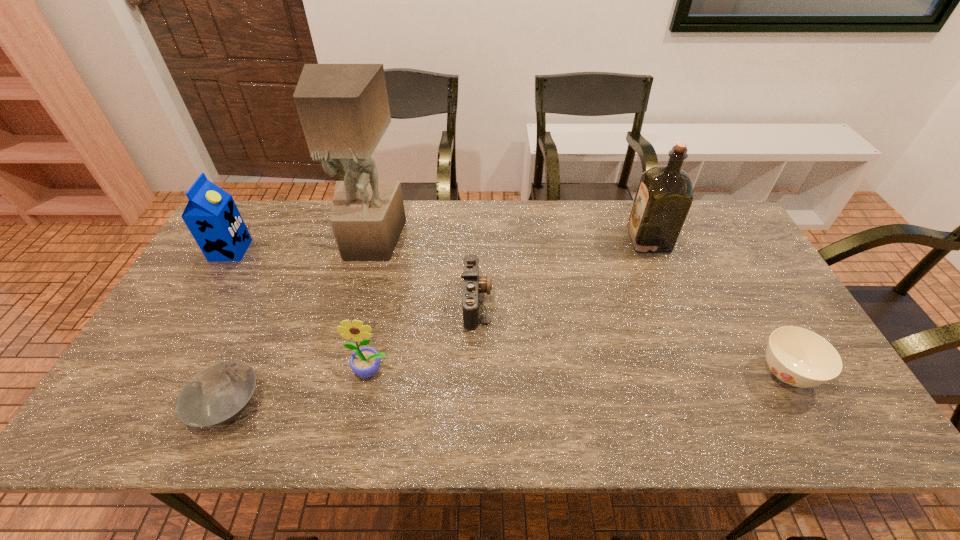
This screenshot has height=540, width=960. I want to click on sculpture that is at the far edge, so click(344, 111).

You are a GUI agent. You are given a task and a screenshot of the screen. Output one action in this format:
    pyautogui.click(x=<x>, y=<y>)
    Task: Click on the liquor at the far edge
    This screenshot has width=960, height=540.
    Given the screenshot: What is the action you would take?
    pyautogui.click(x=664, y=196)

I want to click on carton that is positioned at the far edge, so click(x=211, y=215).

Where is `object situated at the near edge`? object situated at the near edge is located at coordinates (219, 393).

You are a GUI agent. You are given a task and a screenshot of the screen. Output one action in this format:
    pyautogui.click(x=<x>, y=<y>)
    Task: Click on the object positioned at the left edge
    This screenshot has height=540, width=960.
    Given the screenshot: What is the action you would take?
    pyautogui.click(x=211, y=215)

Where is `object located in the right edge section of the desktop`? The width and height of the screenshot is (960, 540). object located in the right edge section of the desktop is located at coordinates (799, 357).

Where is `object at the far left corner`? object at the far left corner is located at coordinates (211, 215).

The image size is (960, 540). In order to click on vacant space at the far edge of the desktop in this screenshot , I will do `click(602, 206)`.

Identify the location of free space at the near edge of the desktop. 622,415.

Image resolution: width=960 pixels, height=540 pixels. Find the location of `vacant space at the left edge`. vacant space at the left edge is located at coordinates (133, 395).